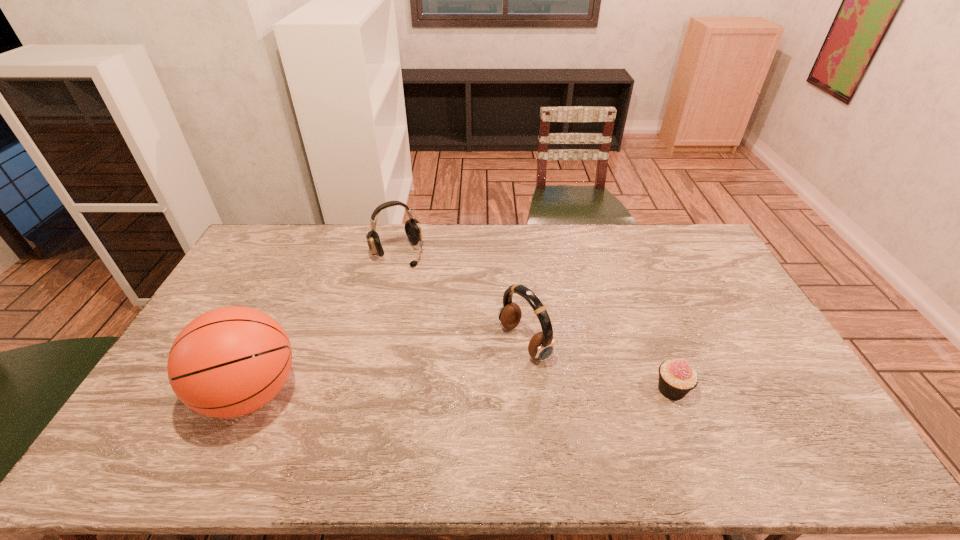
At what (x,y) coordinates should I click in order to perform the action: click on free spot between the shortest object and the tallest object. Please return your answer as a coordinate pair (x, y). Image resolution: width=960 pixels, height=540 pixels. Looking at the image, I should click on (462, 391).

You are a GUI agent. You are given a task and a screenshot of the screen. Output one action in this format:
    pyautogui.click(x=<x>, y=<y>)
    Task: Click on the unoccupied area between the rightmost object and the nearer headset
    
    Given the screenshot: What is the action you would take?
    pyautogui.click(x=598, y=366)

This screenshot has height=540, width=960. I want to click on free space between the shortest object and the third object from left to right, so click(x=598, y=366).

The height and width of the screenshot is (540, 960). Find the location of `vacant area that lies between the leftmost object and the shortest object`. vacant area that lies between the leftmost object and the shortest object is located at coordinates (462, 391).

Locate an element on the screen. free space between the tallest object and the rightmost object is located at coordinates (462, 391).

The image size is (960, 540). Identify the location of free area in between the cupcake and the second object from left to right. (535, 321).

Locate which object ranks in proximity to the cupcake. Please provide its 2D coordinates. Your answer should be formatted as a tuple, i.e. [(x, y)], where the tuple contains the x and y coordinates of a point satisfying the conditions above.

[(541, 345)]

The image size is (960, 540). I want to click on object that ranks as the second closest to the farthest object, so click(x=228, y=362).

Where is `vacant space that satisfies the following two spatial constraints: 1. on the back side of the leftmost object; 2. on the right side of the third object from left to right`? The height and width of the screenshot is (540, 960). vacant space that satisfies the following two spatial constraints: 1. on the back side of the leftmost object; 2. on the right side of the third object from left to right is located at coordinates (275, 342).

Where is `vacant space that satisfies the following two spatial constraints: 1. on the back side of the third object from left to right; 2. on the right side of the leftmost object`? This screenshot has height=540, width=960. vacant space that satisfies the following two spatial constraints: 1. on the back side of the third object from left to right; 2. on the right side of the leftmost object is located at coordinates (275, 342).